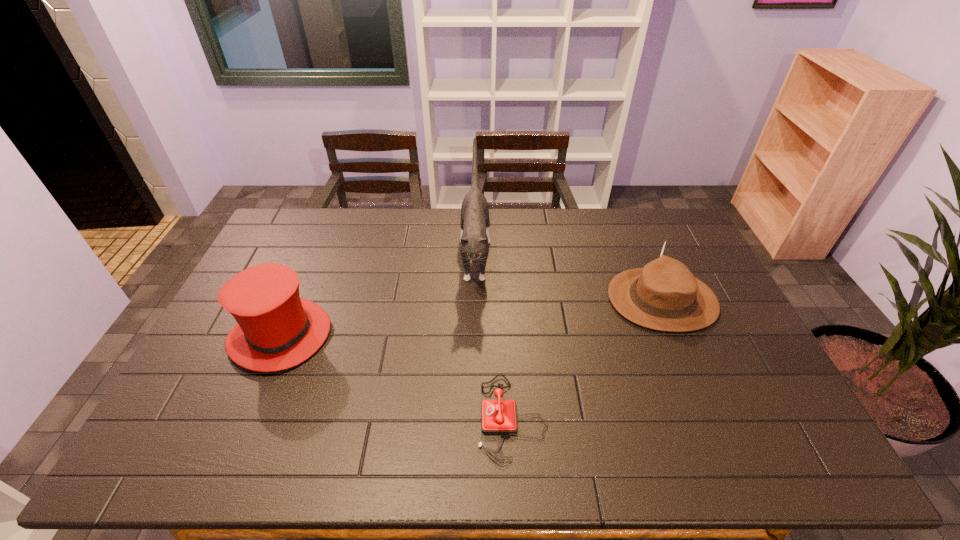
Where is `free space that is in between the third tallest object and the hat`? The image size is (960, 540). free space that is in between the third tallest object and the hat is located at coordinates (471, 318).

This screenshot has height=540, width=960. Identify the location of vacant space in between the telephone and the rightmost object. (587, 359).

At what (x,y) coordinates should I click in order to perform the action: click on vacant point located between the shortest object and the second shortest object. Please return your answer as a coordinate pair (x, y). This screenshot has width=960, height=540. Looking at the image, I should click on (587, 359).

In order to click on object that is the second nearest to the telephone in this screenshot , I will do `click(664, 295)`.

Identify which object is the second nearest to the cat. Please provide its 2D coordinates. Your answer should be formatted as a tuple, i.e. [(x, y)], where the tuple contains the x and y coordinates of a point satisfying the conditions above.

[(276, 329)]